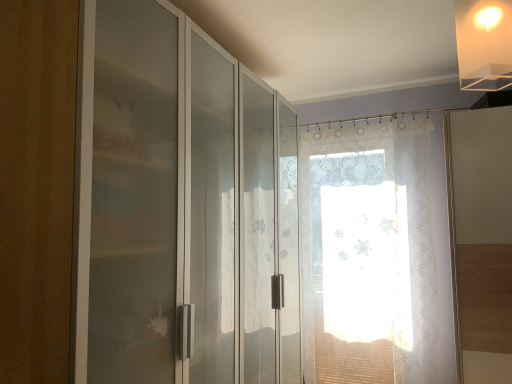
Question: Is translucent floral curtain at center inside or outside of translucent acrylic lampshade at upper right?

Choices:
 (A) outside
 (B) inside

Answer: (A)

Question: In terms of height, does translucent floral curtain at center look taller or shorter compared to translucent acrylic lampshade at upper right?

Choices:
 (A) short
 (B) tall

Answer: (B)

Question: Which object is positioned closest to the translucent floral curtain at center?

Choices:
 (A) translucent acrylic lampshade at upper right
 (B) frosted glass cabinet at left

Answer: (B)

Question: Which is nearer to the translucent floral curtain at center?

Choices:
 (A) frosted glass cabinet at left
 (B) translucent acrylic lampshade at upper right

Answer: (A)